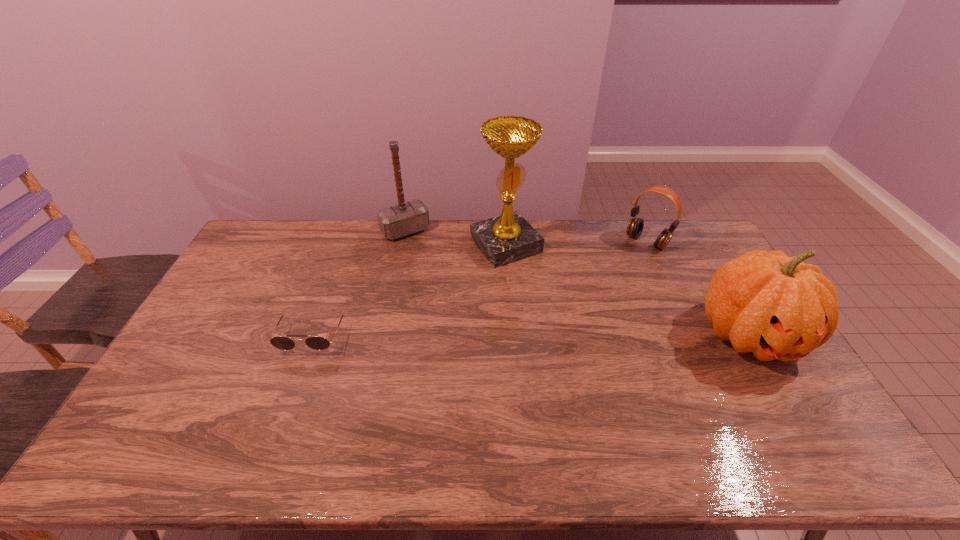
Locate an element on the screen. This screenshot has height=540, width=960. sunglasses is located at coordinates (319, 343).

Where is `the shortest object`? The image size is (960, 540). the shortest object is located at coordinates (319, 343).

Identify the location of pumpkin. (777, 307).

This screenshot has height=540, width=960. What are the coordinates of `the fourth tallest object` in the screenshot? It's located at (635, 226).

Where is `the tallest object`? The width and height of the screenshot is (960, 540). the tallest object is located at coordinates (507, 238).

You are a GUI agent. You are given a task and a screenshot of the screen. Output one action in this format:
    pyautogui.click(x=<x>, y=<y>)
    Task: Click on the third object from right to left
    The height and width of the screenshot is (540, 960).
    Given the screenshot: What is the action you would take?
    pyautogui.click(x=507, y=238)

Find the location of `the fourth object from right to left`. the fourth object from right to left is located at coordinates (406, 218).

You are a GUI agent. You are given a task and a screenshot of the screen. Output one action in this format:
    pyautogui.click(x=<x>, y=<y>)
    Task: Click on the vacant space situated on the front lenses of the leftmost object
    
    Given the screenshot: What is the action you would take?
    pyautogui.click(x=282, y=419)

Locate an element on the screen. The image size is (960, 540). vacant space located on the carved face of the pumpkin is located at coordinates (786, 398).

Where is `free space located on the ear cups of the headset`? This screenshot has height=540, width=960. free space located on the ear cups of the headset is located at coordinates (622, 267).